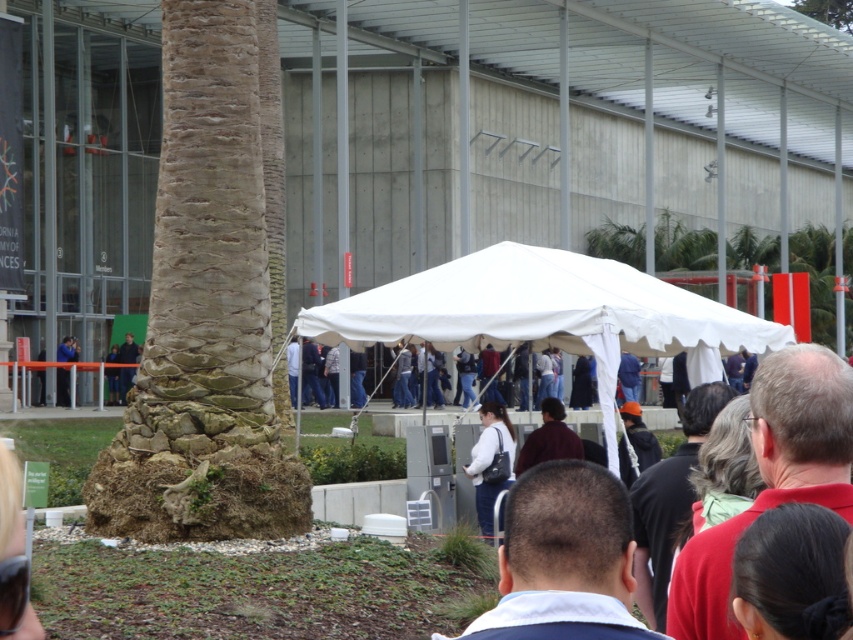
What do you see at coordinates (772, 477) in the screenshot? Image resolution: width=853 pixels, height=640 pixels. I see `red shirt at center` at bounding box center [772, 477].

You are a GUI agent. You are given a task and a screenshot of the screen. Output one action in this format:
    pyautogui.click(x=<x>, y=<y>)
    Task: Click on the red shirt at center
    This screenshot has width=853, height=640.
    Given the screenshot: What is the action you would take?
    pyautogui.click(x=772, y=477)

This screenshot has width=853, height=640. I want to click on red shirt at center, so click(772, 477).

Is point (727, 531) positioned after point (132, 349)?

No, it is not.

Between red shirt at center and dark blue jeans at center, which one appears on the right side from the viewer's perspective?

red shirt at center is more to the right.

Is point (712, 602) behind point (132, 371)?

No.

Identify the location of red shirt at center. Image resolution: width=853 pixels, height=640 pixels. (772, 477).

Consider the image. Is white fabric tent at center further to camera compared to white matte jacket at center?

No, white fabric tent at center is closer to the viewer.

Between point (447, 266) and point (482, 486), which one is positioned behind?

Positioned behind is point (447, 266).

Who is more distant from viewer, (492, 291) or (482, 476)?

Point (482, 476)

Identify the location of white fabric tent at center. The height and width of the screenshot is (640, 853). (544, 314).